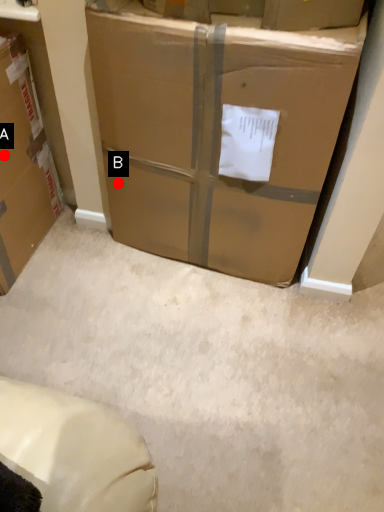
Question: Two points are circled on the image, labeled by A and B beside each circle. Which point is further to the camera?

Choices:
 (A) A is further
 (B) B is further

Answer: (B)